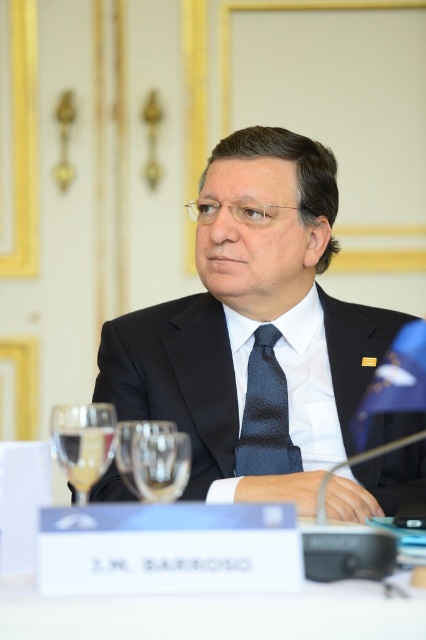
You are a fashion designer observing a man in a formal setting. You notice the black silk suit at center and the white satin dress shirt at center. Which clothing item takes up more space in the outfit?

The black silk suit at center has a larger size compared to the white satin dress shirt at center, so the black silk suit at center takes up more space in the outfit.

You are a photographer adjusting your camera to capture the scene. You notice two points in the image at coordinates point (138, 385) and point (331, 403). Which point is closer to the camera?

Point (138, 385) is closer to the camera than point (331, 403).